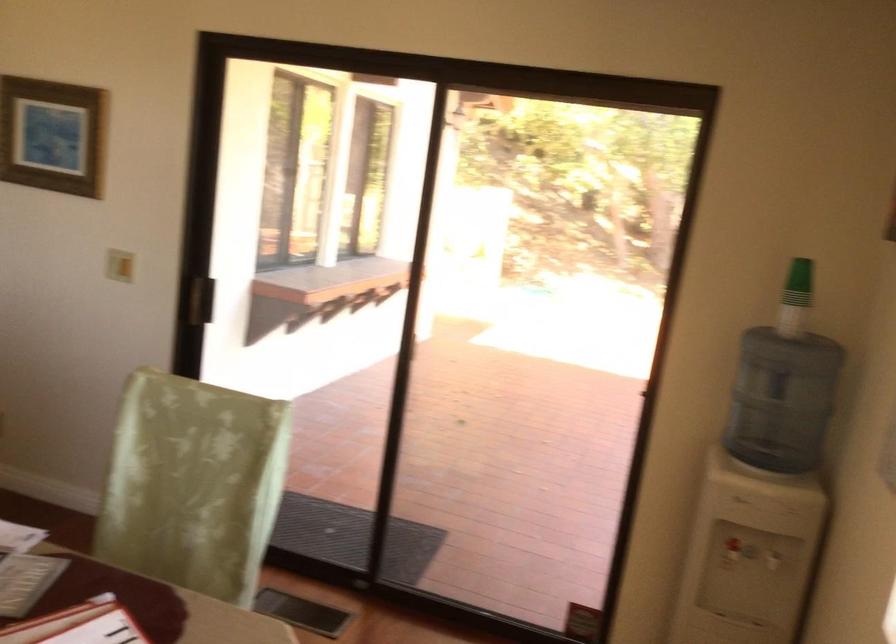
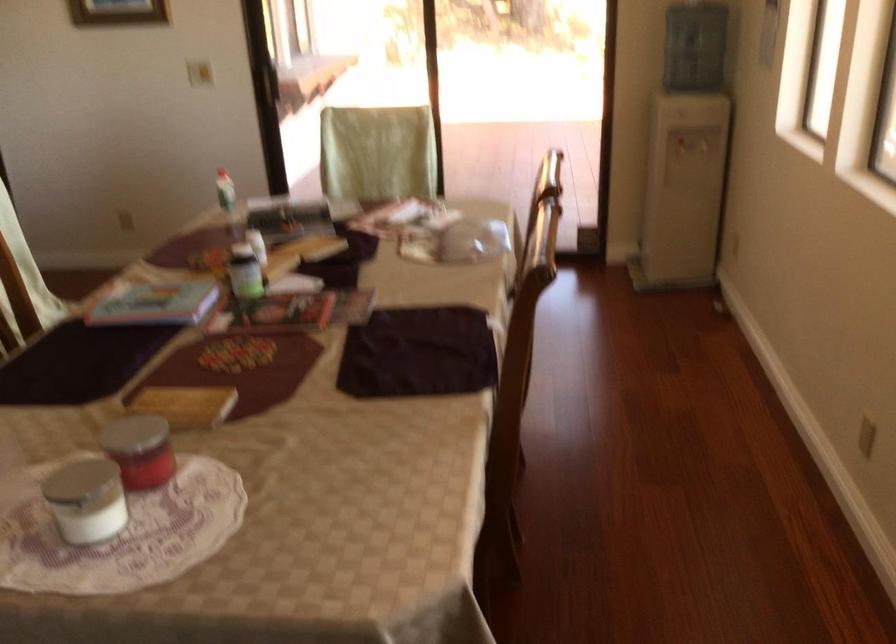
Which direction would the cameraman need to move to produce the second image?

The movement direction of the cameraman is left, backward.